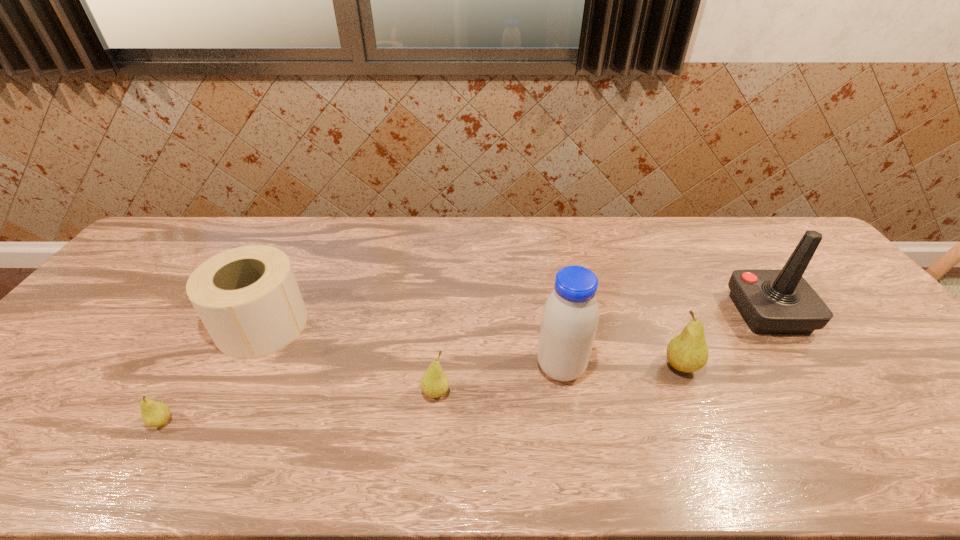
The width and height of the screenshot is (960, 540). What are the coordinates of `vacant space that is in between the toilet tissue and the tallest pear` in the screenshot? It's located at (471, 346).

Find the location of `free space between the toilet tissue and the joystick`. free space between the toilet tissue and the joystick is located at coordinates (516, 319).

Find the location of a particular element. The image size is (960, 540). unoccupied position between the fourth object from left to right and the toilet tissue is located at coordinates (412, 346).

Where is `vacant space in between the toilet tissue and the third object from right to left`? The width and height of the screenshot is (960, 540). vacant space in between the toilet tissue and the third object from right to left is located at coordinates (412, 346).

Locate an element on the screen. Image resolution: width=960 pixels, height=540 pixels. free space that is in between the rightmost pear and the third object from right to left is located at coordinates (621, 367).

Find the location of a particular element. Image resolution: width=960 pixels, height=540 pixels. free spot between the tallest pear and the rightmost object is located at coordinates (725, 340).

Where is `object that is the fourth closest one to the soya milk`? This screenshot has height=540, width=960. object that is the fourth closest one to the soya milk is located at coordinates (248, 299).

This screenshot has height=540, width=960. Find the location of `the fifth closest object to the toilet tissue`. the fifth closest object to the toilet tissue is located at coordinates (770, 301).

Where is `the closest pear to the rightmost pear`? the closest pear to the rightmost pear is located at coordinates (434, 383).

The image size is (960, 540). What are the coordinates of `pear object that ranks as the second closest to the tallest pear` in the screenshot? It's located at (153, 413).